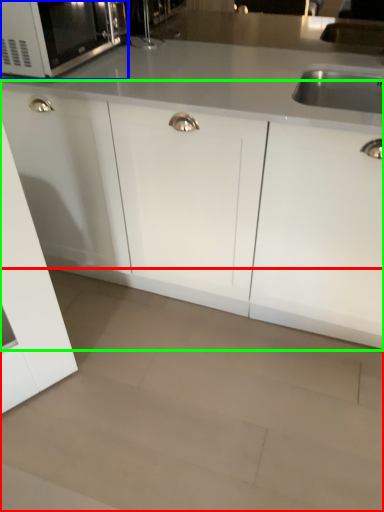
Question: Which is nearer to the granite (highlighted by a red box)? microwave oven (highlighted by a blue box) or cabinetry (highlighted by a green box).

Choices:
 (A) microwave oven
 (B) cabinetry

Answer: (B)